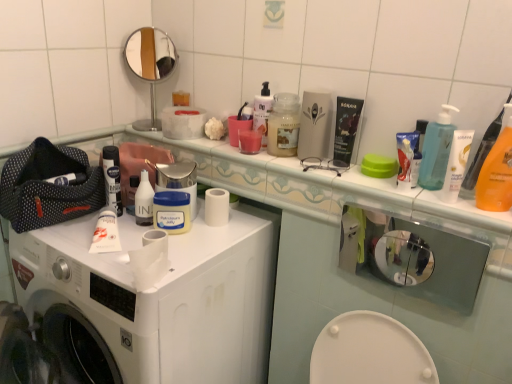
Locate an element on the screen. vacant space to the left of white glossy bottle at center, the first mouthwash viewed from the left is located at coordinates (70, 231).